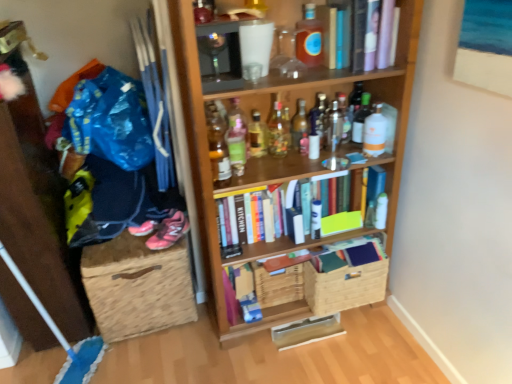
This screenshot has width=512, height=384. I want to click on vacant space situated above wooden crate at center, positioned as the 1th basket in left-to-right order (from a real-world perspective), so click(x=287, y=256).